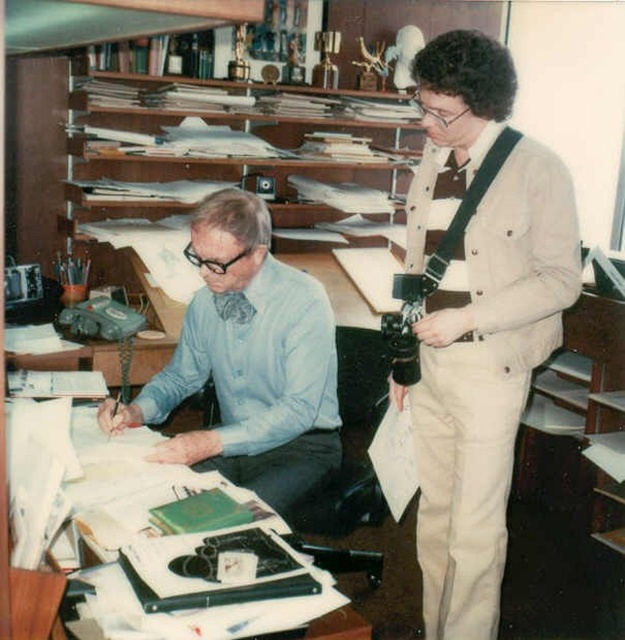
Who is shorter, beige cotton shirt at right or blue shirt at center?

Result: blue shirt at center is shorter.

Can you confirm if beige cotton shirt at right is thinner than blue shirt at center?

Indeed, beige cotton shirt at right has a lesser width compared to blue shirt at center.

Is point (466, 196) less distant than point (266, 428)?

Yes, point (466, 196) is in front of point (266, 428).

This screenshot has width=625, height=640. I want to click on beige cotton shirt at right, so click(486, 384).

Who is higher up, wooden shelves at upper center or white paper at center?

wooden shelves at upper center is above.

You are a GUI agent. You are given a task and a screenshot of the screen. Output one action in this format:
    pyautogui.click(x=<x>, y=<y>)
    Task: Click on the wooden shelves at upper center
    The image size is (625, 640).
    Given the screenshot: What is the action you would take?
    pyautogui.click(x=241, y=148)

What do you see at coordinates (241, 148) in the screenshot? The height and width of the screenshot is (640, 625). I see `wooden shelves at upper center` at bounding box center [241, 148].

Find the location of `wooden shelves at upper center`. wooden shelves at upper center is located at coordinates (241, 148).

The height and width of the screenshot is (640, 625). What do you see at coordinates (486, 384) in the screenshot?
I see `beige cotton shirt at right` at bounding box center [486, 384].

Can you confirm if beige cotton shirt at right is shorter than wooden shelves at upper center?

No.

This screenshot has height=640, width=625. I want to click on beige cotton shirt at right, so click(486, 384).